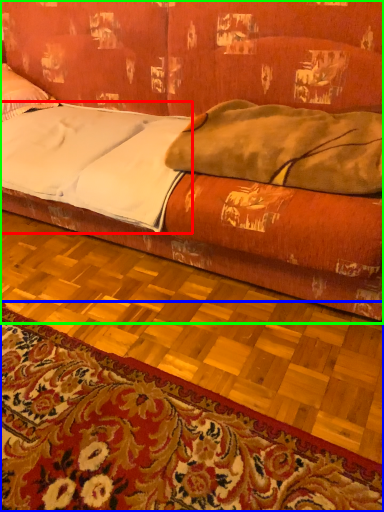
Question: Which object is positioned farthest from sheet (highlighted by a red box)? Select from mat (highlighted by a blue box) and studio couch (highlighted by a green box).

Choices:
 (A) mat
 (B) studio couch

Answer: (A)